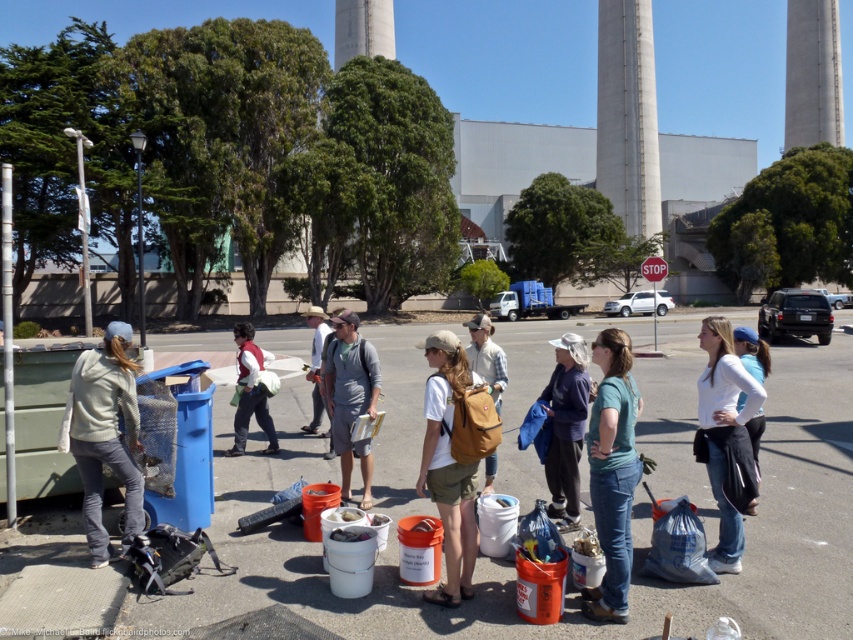
Between matte teal shirt at center and brown leather backpack at center, which one appears on the left side from the viewer's perspective?

Positioned to the left is brown leather backpack at center.

You are a GUI agent. You are given a task and a screenshot of the screen. Output one action in this format:
    pyautogui.click(x=<x>, y=<y>)
    Task: Click on the matte teal shirt at center
    
    Given the screenshot: What is the action you would take?
    pyautogui.click(x=612, y=472)

Is light gray fleece jacket at left to the left of white cotton shirt at center from the viewer's perspective?

Indeed, light gray fleece jacket at left is positioned on the left side of white cotton shirt at center.

Who is more distant from viewer, (91,362) or (700,380)?

The point (700,380) is behind.

Locate an element on the screen. The image size is (853, 640). light gray fleece jacket at left is located at coordinates (106, 435).

Between brown leather backpack at center and white cotton shirt at center, which one has less height?

white cotton shirt at center is shorter.

Between point (457, 577) and point (715, 481), which one is positioned in front?

Point (457, 577) is more forward.

Locate an element on the screen. The width and height of the screenshot is (853, 640). brown leather backpack at center is located at coordinates (448, 467).